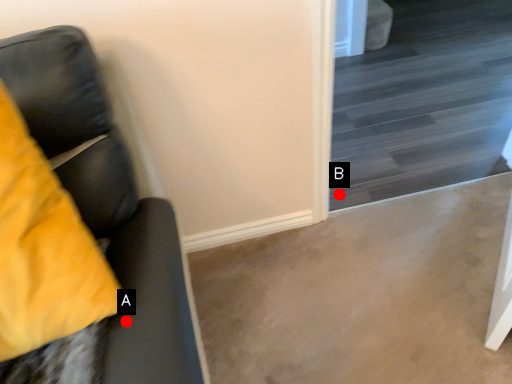
Question: Two points are circled on the image, labeled by A and B beside each circle. Which point is closer to the camera taking this photo?

Choices:
 (A) A is closer
 (B) B is closer

Answer: (A)